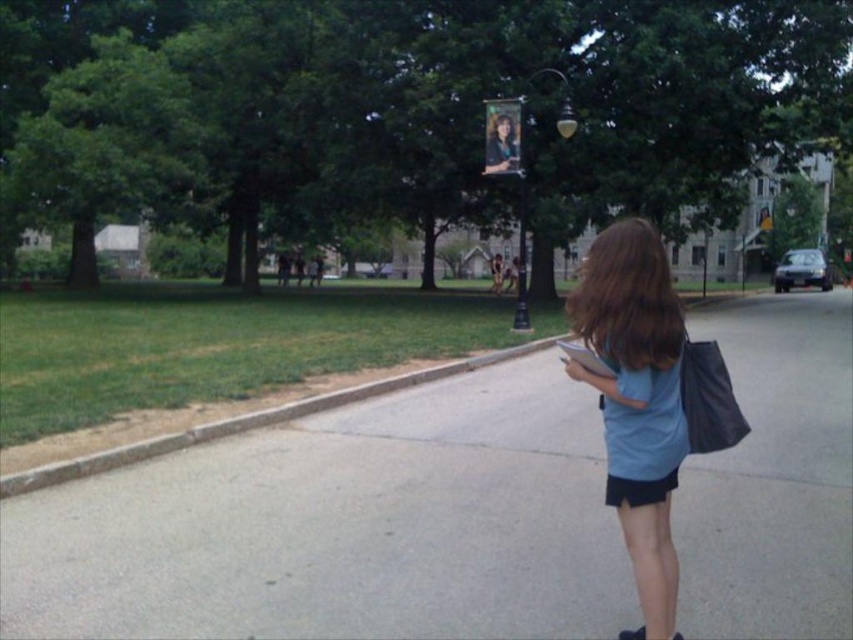
You are a photographer trying to capture the two hair strands in the image. Which hair strand, the brown smooth hair at center or the brown matte hair at upper center, would you need to zoom in more on to get a clear closeup?

The brown matte hair at upper center is narrower in width compared to the brown smooth hair at center, so you would need to zoom in more on the brown matte hair at upper center to get a clear closeup.

From the picture: You are standing at the lower left corner of the image. Looking towards the center, which object would you see first between the brown smooth hair at center and the gray concrete curb at lower left?

The brown smooth hair at center is located above the gray concrete curb at lower left, so you would see the brown smooth hair at center first.